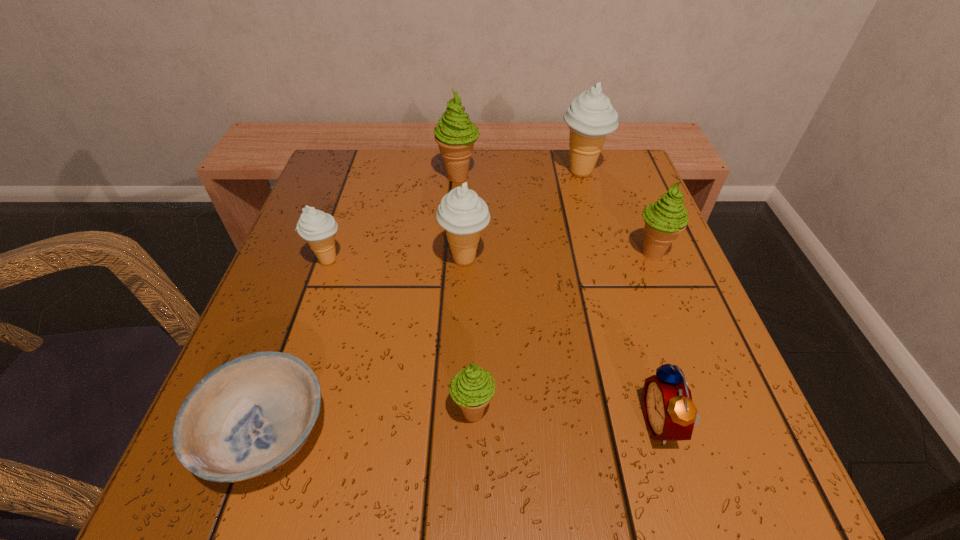
You are a GUI agent. You are given a task and a screenshot of the screen. Output one action in this format:
    pyautogui.click(x=<x>, y=<y>)
    Task: Click on the object at the near right corner
    Image resolution: width=960 pixels, height=540 pixels.
    Given the screenshot: What is the action you would take?
    pyautogui.click(x=670, y=415)

Locate an element on the screen. vacant space at the far edge of the desktop is located at coordinates (394, 163).

The width and height of the screenshot is (960, 540). In the image, there is a desktop. What are the coordinates of `vacant space at the near edge` in the screenshot? It's located at (494, 495).

Image resolution: width=960 pixels, height=540 pixels. I want to click on vacant area at the left edge of the desktop, so click(x=288, y=262).

What are the coordinates of `vacant region at the right edge of the desktop` in the screenshot? It's located at (678, 360).

The width and height of the screenshot is (960, 540). In order to click on vacant space at the far left corner in this screenshot , I will do `click(319, 197)`.

Image resolution: width=960 pixels, height=540 pixels. Identify the location of free area in between the second beige icecream from right to left and the nearest icecream. (468, 335).

Where is `unoccupied position between the farthest beige icecream and the shortest object`? This screenshot has width=960, height=540. unoccupied position between the farthest beige icecream and the shortest object is located at coordinates (424, 303).

You are a GUI agent. You are given a task and a screenshot of the screen. Output one action in this format:
    pyautogui.click(x=<x>, y=<y>)
    Task: Click on the vacant region between the nearest icecream and the rightmost beige icecream
    This screenshot has width=960, height=540.
    Given the screenshot: What is the action you would take?
    pyautogui.click(x=527, y=292)

This screenshot has width=960, height=540. Identify the location of blank region between the second nearest green icecream and the second smallest beige icecream. (559, 256).